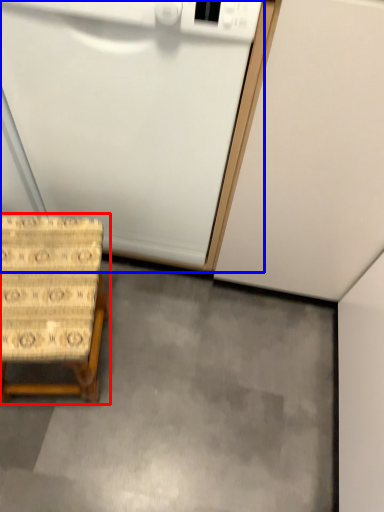
Question: Which of the following is the farthest to the observer, furniture (highlighted by a red box) or appliance (highlighted by a blue box)?

Choices:
 (A) furniture
 (B) appliance

Answer: (A)